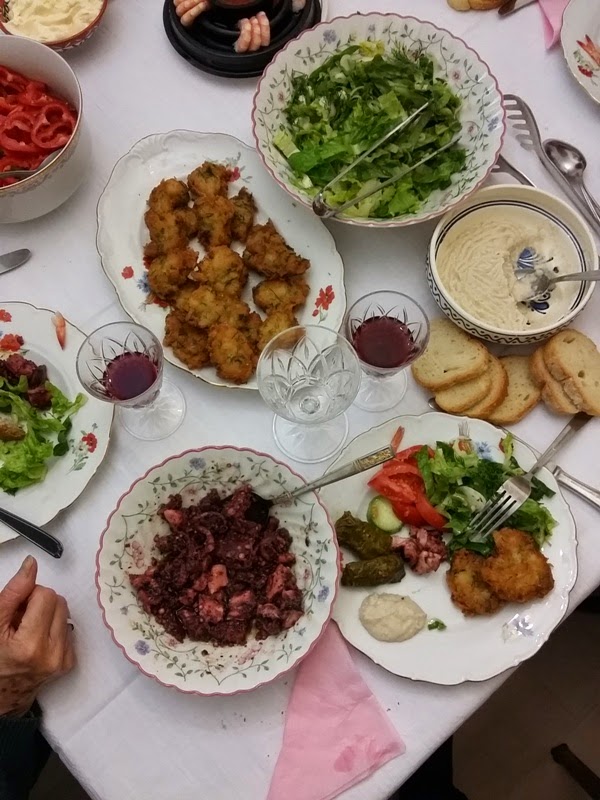
Where is `glass with wine`? The image size is (600, 800). glass with wine is located at coordinates (147, 429), (395, 397).